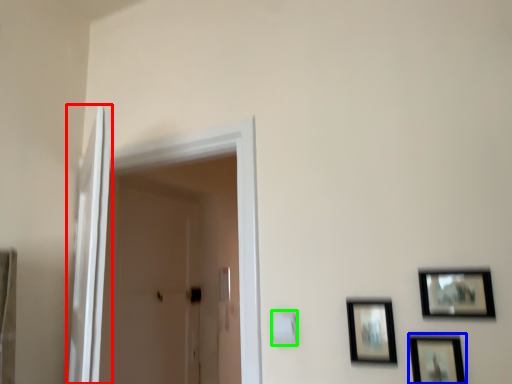
Question: Which object is the closest to the screen door (highlighted by a red box)? Choose among these: picture frame (highlighted by a blue box) or light switch (highlighted by a green box).

Choices:
 (A) picture frame
 (B) light switch

Answer: (B)